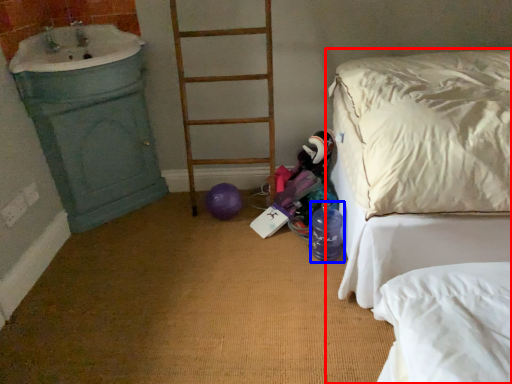
Question: Which of the following is the farthest to the observer, bed (highlighted by a red box) or bottle (highlighted by a blue box)?

Choices:
 (A) bed
 (B) bottle

Answer: (B)